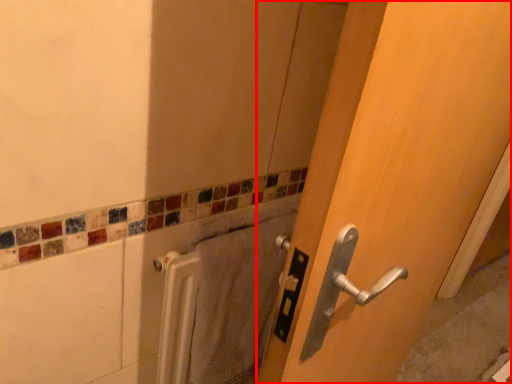
Question: From the image's perspective, what is the correct spatial positioning of door (annotated by the red box) in reference to bath towel?

Choices:
 (A) below
 (B) above

Answer: (B)